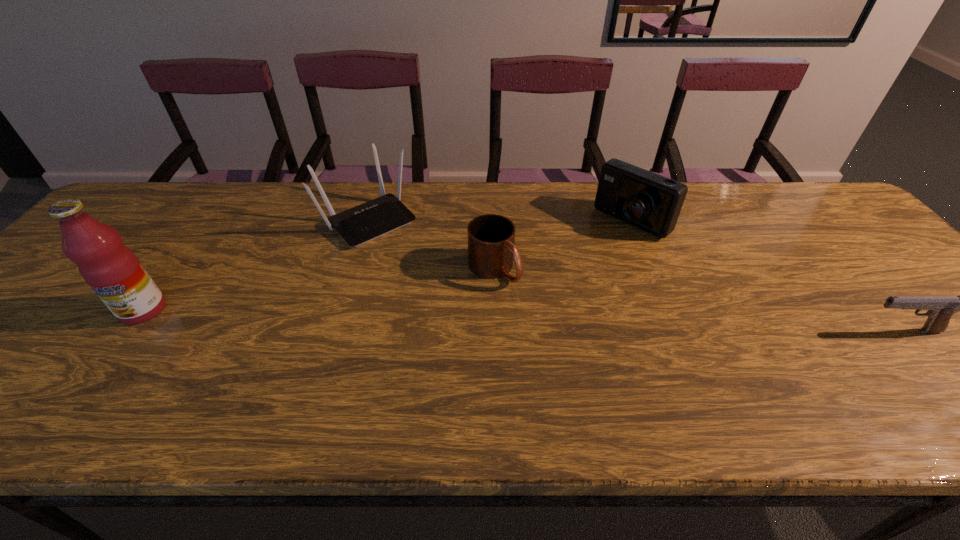
Locate an element on the screen. This screenshot has height=540, width=960. vacant space located 0.170m at the barrel of the rightmost object is located at coordinates click(786, 331).

At what (x,y) coordinates should I click in order to perform the action: click on blank space located on the front-facing side of the router. Please return your answer as a coordinate pair (x, y). Image resolution: width=960 pixels, height=540 pixels. Looking at the image, I should click on (479, 329).

Find the location of a particular element. Image resolution: width=960 pixels, height=540 pixels. free location located 0.360m on the front-facing side of the router is located at coordinates (474, 323).

Identify the location of free space located 0.140m on the front-facing side of the router. This screenshot has width=960, height=540. (421, 271).

This screenshot has width=960, height=540. Find the location of `free region located on the front-facing side of the second object from right to left`. free region located on the front-facing side of the second object from right to left is located at coordinates (580, 260).

This screenshot has width=960, height=540. I want to click on vacant region located 0.180m on the front-facing side of the second object from right to left, so click(572, 266).

This screenshot has width=960, height=540. Identify the location of free region located on the front-facing side of the second object from right to left. (547, 285).

Find the location of `free spot located 0.300m on the side of the third object from right to left with the handle`. free spot located 0.300m on the side of the third object from right to left with the handle is located at coordinates (601, 370).

You are a GUI agent. You are given a task and a screenshot of the screen. Output one action in this format:
    pyautogui.click(x=<x>, y=<y>)
    Task: Click on the free region located 0.110m on the side of the third object from right to left with the handle
    
    Given the screenshot: What is the action you would take?
    pyautogui.click(x=540, y=314)

Find the location of a particular element. This screenshot has height=540, width=960. vacant point located 0.340m on the side of the third object from right to left with the handle is located at coordinates (616, 384).